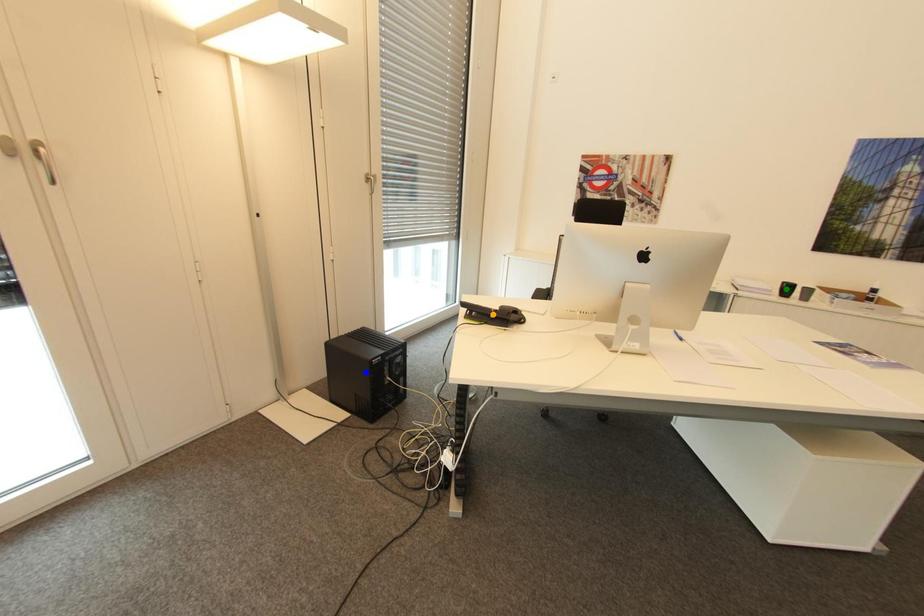
Order these from nearest to farthest:
A) blue point
B) orange point
C) green point

orange point
blue point
green point